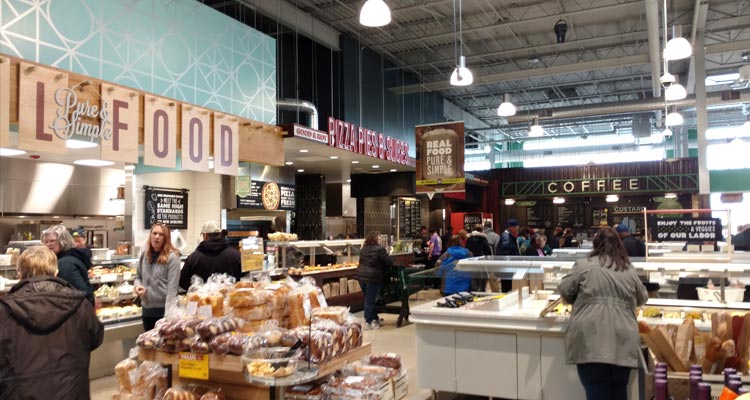
Where is `white lights hanging from supermarket ceiling on top right side`? The width and height of the screenshot is (750, 400). white lights hanging from supermarket ceiling on top right side is located at coordinates (680, 56), (663, 98), (676, 125), (506, 105), (454, 79), (372, 33).